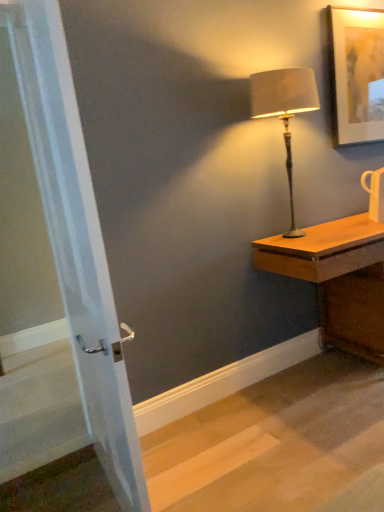
Where is `vacant area on the back side of white glossy screen door at left`? The image size is (384, 512). vacant area on the back side of white glossy screen door at left is located at coordinates (173, 444).